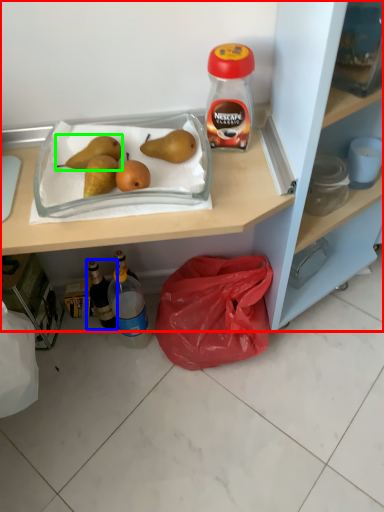
Question: Which is nearer to the cabinetry (highlighted by a red box)? bottle (highlighted by a blue box) or pear (highlighted by a green box).

Choices:
 (A) bottle
 (B) pear

Answer: (B)